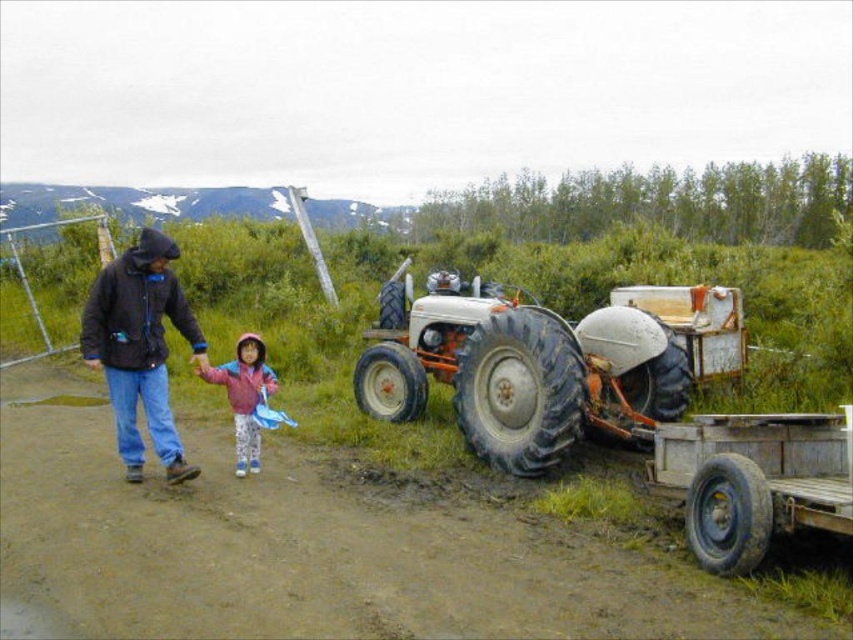
Question: Is white rubber tractor at center closer to camera compared to red fleece jacket at center?

Choices:
 (A) no
 (B) yes

Answer: (A)

Question: Can you confirm if white rubber tractor at center is thinner than red fleece jacket at center?

Choices:
 (A) yes
 (B) no

Answer: (B)

Question: Which of the following is the farthest from the observer?

Choices:
 (A) (102, 310)
 (B) (740, 420)

Answer: (A)

Question: Estimate the real-world distances between objects in this image. Which object is farther from the wooden trailer truck at lower right?

Choices:
 (A) black matte jacket at left
 (B) white rubber tractor at center
 (C) brown dirt track at lower left
 (D) red fleece jacket at center

Answer: (A)

Question: Does white rubber tractor at center have a larger size compared to red fleece jacket at center?

Choices:
 (A) no
 (B) yes

Answer: (B)

Question: Estimate the real-world distances between objects in this image. Which object is farther from the white rubber tractor at center?

Choices:
 (A) red fleece jacket at center
 (B) wooden trailer truck at lower right
 (C) black matte jacket at left

Answer: (C)